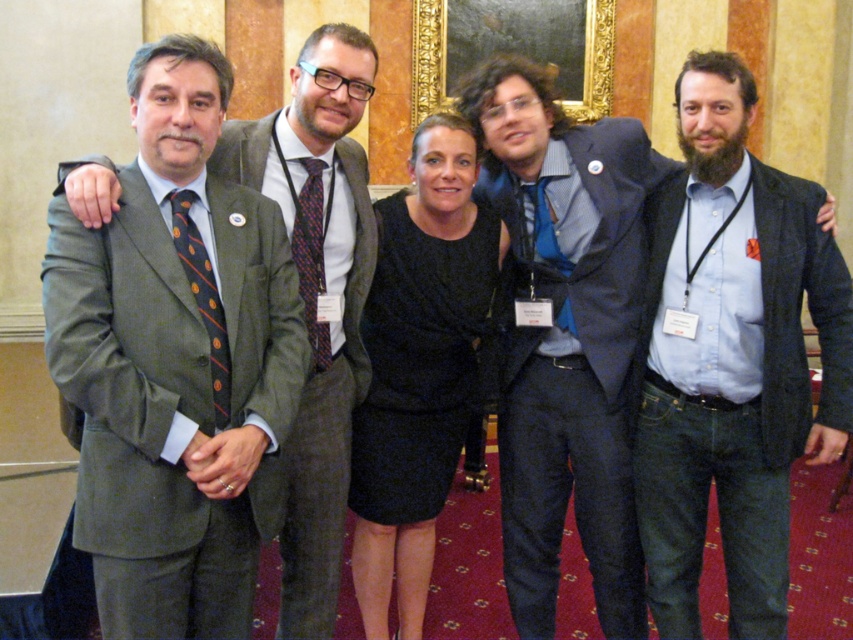
You are standing in front of the group and want to hand a document to the person wearing the dark blue textured suit at center and the person wearing the black satin dress at center. Which person should you approach first to ensure you reach them without having to walk around others?

You should approach the dark blue textured suit at center first because it is closer to you than the black satin dress at center.

You are a photographer adjusting the lighting for a group photo. You notice the matte gray suit at center and the dark blue textured suit at center. Which suit is blocking the light from reaching the other?

The matte gray suit at center is positioned over the dark blue textured suit at center, so it is blocking the light from reaching the dark blue textured suit at center.

You are standing in the room and want to greet the person wearing the matte gray suit at center and the person wearing the matte green suit at left. Which person should you approach first if you want to greet the one closer to you?

The matte gray suit at center is below the matte green suit at left, so the matte gray suit at center is closer to you. You should approach the person wearing the matte gray suit at center first.